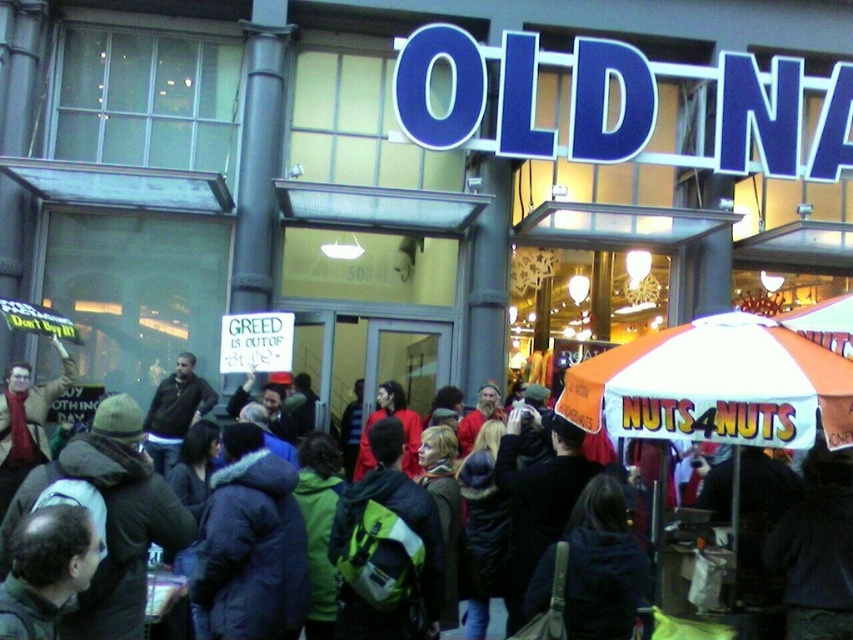
Does orange/white fabric umbrella at right have a lesser width compared to dark brown leather jacket at center?

Incorrect, orange/white fabric umbrella at right's width is not less than dark brown leather jacket at center's.

Does point (721, 326) lie in front of point (181, 374)?

Yes, it is in front of point (181, 374).

Where is `orange/white fabric umbrella at right`? The image size is (853, 640). orange/white fabric umbrella at right is located at coordinates (715, 385).

At what (x,y) coordinates should I click in order to perform the action: click on orange/white fabric umbrella at right. Please return your answer as a coordinate pair (x, y). The image size is (853, 640). Looking at the image, I should click on click(715, 385).